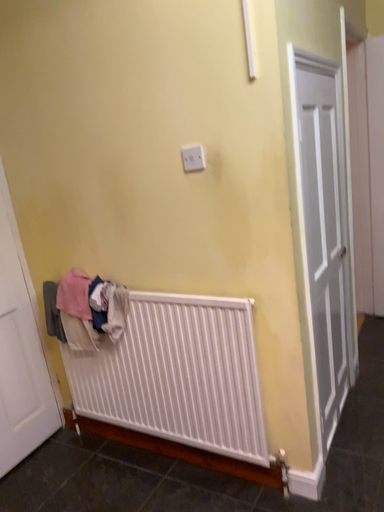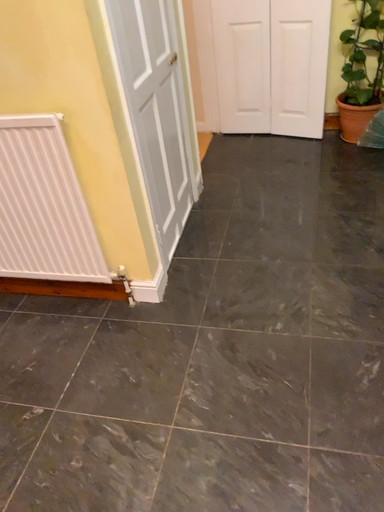
Question: How did the camera likely rotate when shooting the video?

Choices:
 (A) rotated right
 (B) rotated left

Answer: (A)